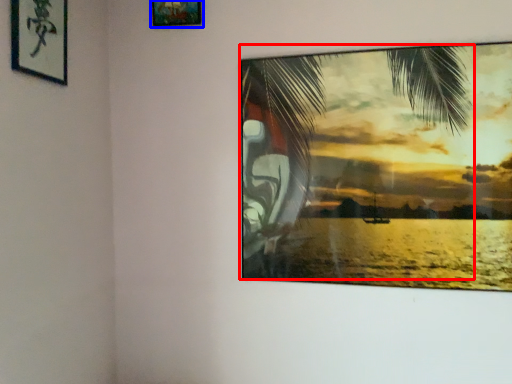
Question: Which object is further to the camera taking this photo, palm tree (highlighted by a red box) or picture frame (highlighted by a blue box)?

Choices:
 (A) palm tree
 (B) picture frame

Answer: (B)